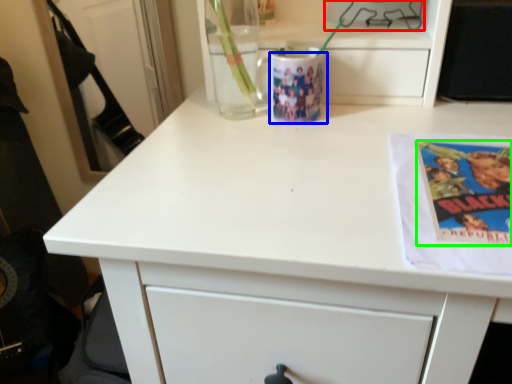
Question: Considering the real-world distances, which object is closest to appliance (highlighted by a red box)? mug (highlighted by a blue box) or paperback book (highlighted by a green box).

Choices:
 (A) mug
 (B) paperback book

Answer: (A)